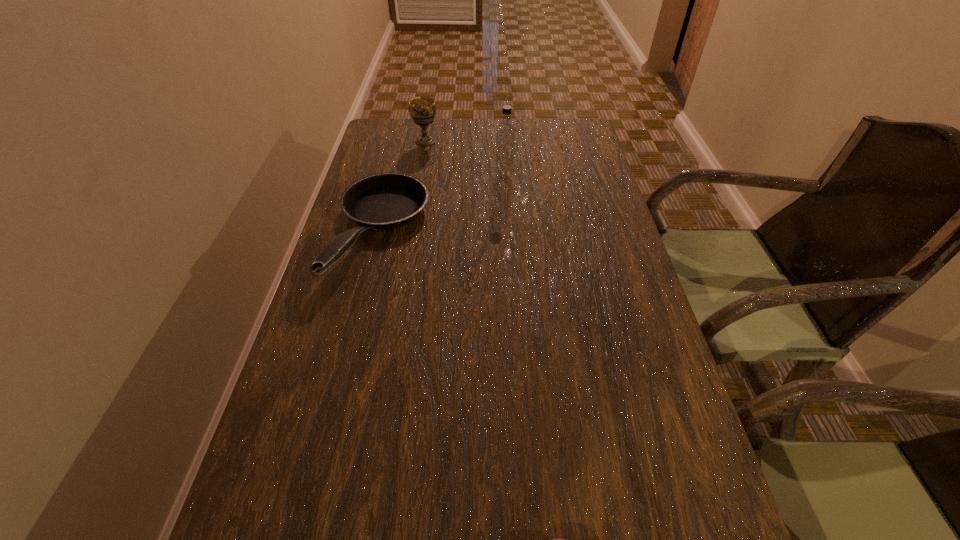
Find the location of a particular element. chalice positioned at the left edge is located at coordinates (422, 110).

This screenshot has height=540, width=960. Identify the location of frying pan located at the left edge. (383, 201).

Identify the location of object located in the far left corner section of the desktop. (422, 110).

You are a GUI agent. You are given a task and a screenshot of the screen. Output one action in this format:
    pyautogui.click(x=<x>, y=<y>)
    Task: Click on the free space at the far edge
    The image size is (960, 540).
    Given the screenshot: What is the action you would take?
    pyautogui.click(x=522, y=143)

In the image, there is a desktop. Where is `vacant space at the left edge`? This screenshot has height=540, width=960. vacant space at the left edge is located at coordinates (327, 389).

You are a GUI agent. You are given a task and a screenshot of the screen. Output one action in this format:
    pyautogui.click(x=<x>, y=<y>)
    Task: Click on the vacant space at the right edge of the desktop
    This screenshot has width=960, height=540.
    Given the screenshot: What is the action you would take?
    pyautogui.click(x=599, y=237)

At what (x,y) coordinates should I click in order to perform the action: click on vacant area at the far right corner. Please return your answer as a coordinate pair (x, y). This screenshot has width=960, height=540. Looking at the image, I should click on (584, 150).

Find the location of a particular element. vacant region between the second shortest object and the water bottle is located at coordinates (443, 205).

Select which object appears as the closest to the water bottle. Please provide its 2D coordinates. Your answer should be formatted as a tuple, i.e. [(x, y)], where the tuple contains the x and y coordinates of a point satisfying the conditions above.

[(383, 201)]

Identify which object is located as the nearest to the third nearest object. Please provide its 2D coordinates. Your answer should be formatted as a tuple, i.e. [(x, y)], where the tuple contains the x and y coordinates of a point satisfying the conditions above.

[(383, 201)]